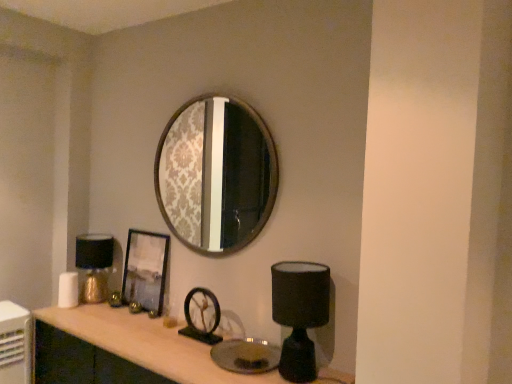
The width and height of the screenshot is (512, 384). In order to click on vacant space in front of gold metallic table lamp at left, positioned as the first table lamp in back-to-front order in this screenshot , I will do `click(84, 312)`.